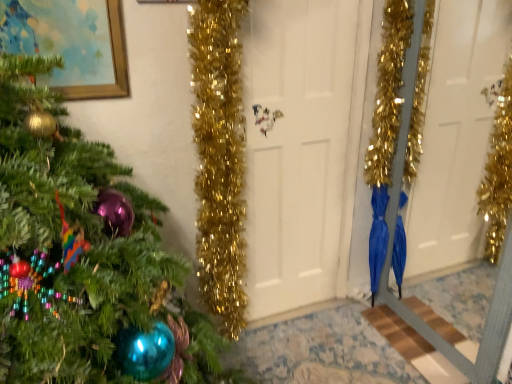
Question: Can you confirm if white matte door at center is positioned to the left of gold-framed painting at upper left?

Choices:
 (A) yes
 (B) no

Answer: (B)

Question: Is white matte door at center positioned with its back to gold-framed painting at upper left?

Choices:
 (A) no
 (B) yes

Answer: (A)

Question: Is white matte door at center taller than gold-framed painting at upper left?

Choices:
 (A) no
 (B) yes

Answer: (B)

Question: From the image's perspective, does white matte door at center appear higher than gold-framed painting at upper left?

Choices:
 (A) no
 (B) yes

Answer: (A)

Question: Can you confirm if white matte door at center is wider than gold-framed painting at upper left?

Choices:
 (A) no
 (B) yes

Answer: (A)

Question: Visually, is white matte door at center positioned to the left or to the right of green matte christmas tree at left?

Choices:
 (A) left
 (B) right

Answer: (B)

Question: From the image's perspective, is white matte door at center above or below green matte christmas tree at left?

Choices:
 (A) above
 (B) below

Answer: (A)

Question: Is point (279, 145) positioned closer to the camera than point (10, 152)?

Choices:
 (A) farther
 (B) closer

Answer: (A)

Question: Is white matte door at center taller or shorter than green matte christmas tree at left?

Choices:
 (A) tall
 (B) short

Answer: (A)

Question: Is green matte christmas tree at left inside the boundaries of blue glossy umbrella at lower right, or outside?

Choices:
 (A) outside
 (B) inside

Answer: (A)

Question: Based on their sizes in the image, would you say green matte christmas tree at left is bigger or smaller than blue glossy umbrella at lower right?

Choices:
 (A) big
 (B) small

Answer: (A)

Question: Considering the positions of green matte christmas tree at left and blue glossy umbrella at lower right in the image, is green matte christmas tree at left taller or shorter than blue glossy umbrella at lower right?

Choices:
 (A) short
 (B) tall

Answer: (B)

Question: Relative to blue glossy umbrella at lower right, is green matte christmas tree at left in front or behind?

Choices:
 (A) behind
 (B) front

Answer: (B)

Question: Considering the positions of blue glossy umbrella at lower right and white matte door at center in the image, is blue glossy umbrella at lower right wider or thinner than white matte door at center?

Choices:
 (A) wide
 (B) thin

Answer: (A)

Question: From a real-world perspective, is blue glossy umbrella at lower right positioned above or below white matte door at center?

Choices:
 (A) above
 (B) below

Answer: (B)